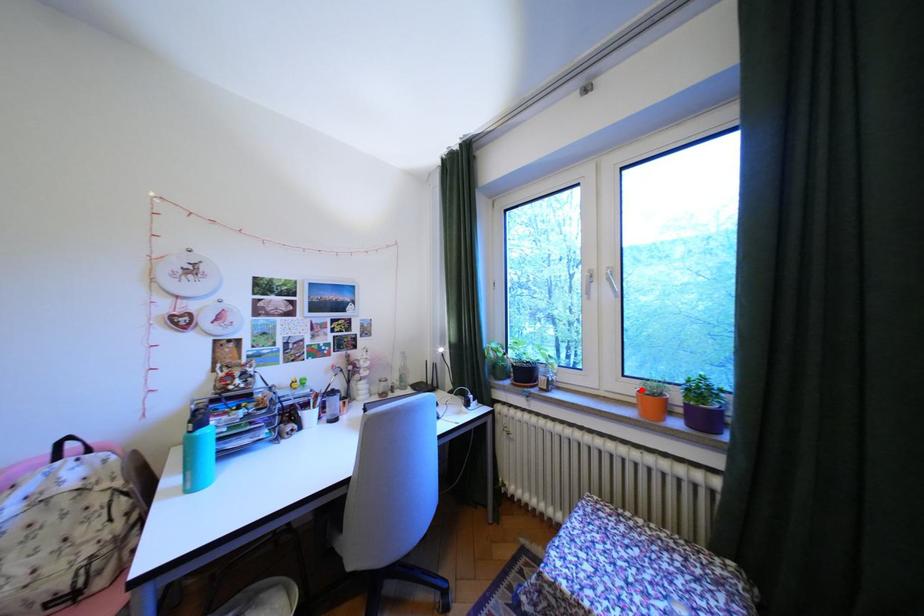
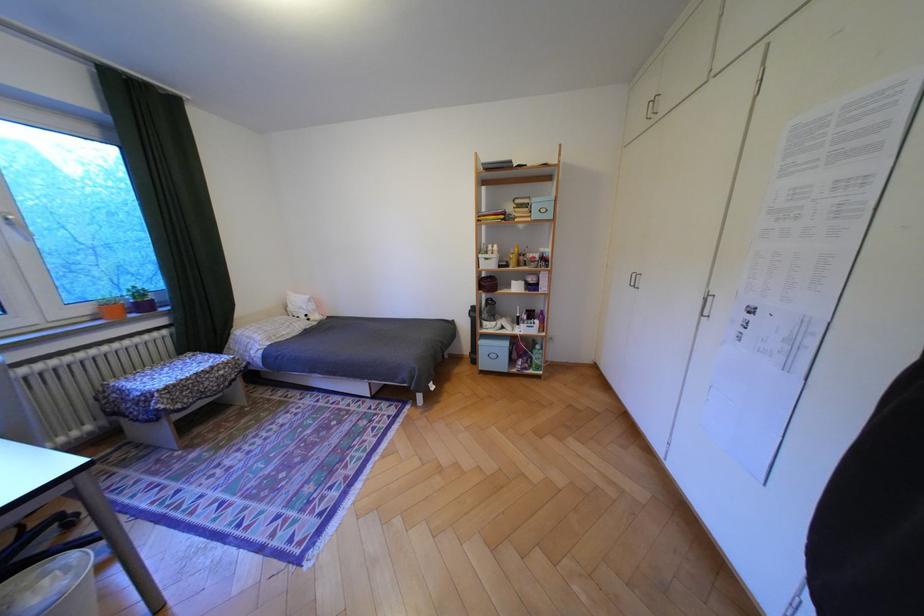
The point at the highlighted location is marked in the first image. Where is the corresponding point in the second image?

(99, 310)